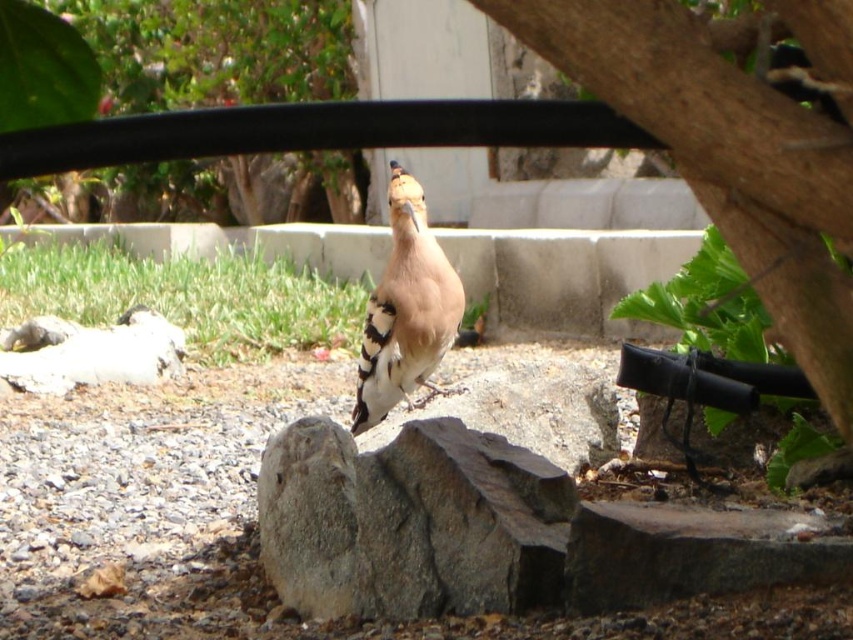
You are a birdwatcher observing the scene. You notice the brown rough bark at upper right and the brown speckled feathers at center. Which object is shorter in height?

The brown rough bark at upper right has a lesser height compared to the brown speckled feathers at center, so the brown rough bark at upper right is shorter in height.

You are standing in the garden and want to place a small flag at the point closest to the bird. Which point should you choose between point (328, 401) and point (369, 364)?

Point (328, 401) is closer to the bird because it is further to the viewer than point (369, 364).

You are standing at the edge of the garden and want to place a small statue exactly at the center of the gray gravel at center. According to the coordinates provided, where should you place the statue?

You should place the statue at the coordinates point (236, 525) where the gray gravel at center is located.